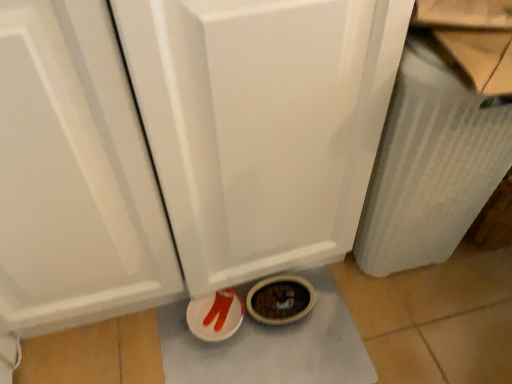
Question: Is white textured bath mat at lower center bigger or smaller than matte plastic shoes at lower center?

Choices:
 (A) big
 (B) small

Answer: (A)

Question: Considering the positions of point (312, 369) and point (206, 301), is point (312, 369) closer or farther from the camera than point (206, 301)?

Choices:
 (A) farther
 (B) closer

Answer: (B)

Question: Which object is positioned farthest from the white textured radiator at right?

Choices:
 (A) matte plastic shoes at lower center
 (B) white textured bath mat at lower center

Answer: (A)

Question: Which is farther from the white textured radiator at right?

Choices:
 (A) white textured bath mat at lower center
 (B) matte plastic shoes at lower center

Answer: (B)